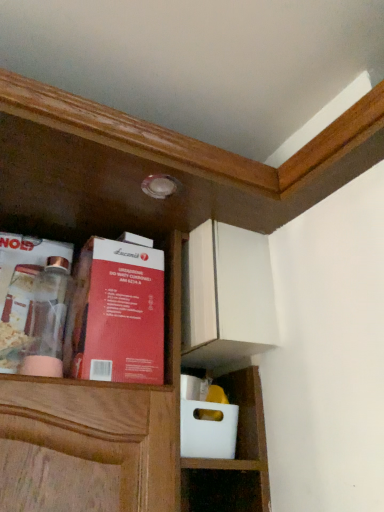
Question: Is clear glass jar at left, positioned as the 1th book in left-to-right order, inside or outside of red cardboard box at upper left, the first book viewed from the right?

Choices:
 (A) inside
 (B) outside

Answer: (B)

Question: In terms of width, does clear glass jar at left, positioned as the 1th book in left-to-right order, look wider or thinner when compared to red cardboard box at upper left, arranged as the 2th book when viewed from the left?

Choices:
 (A) wide
 (B) thin

Answer: (B)

Question: Considering the positions of clear glass jar at left, which ranks as the 2th book in right-to-left order, and red cardboard box at upper left, the first book viewed from the right, in the image, is clear glass jar at left, which ranks as the 2th book in right-to-left order, taller or shorter than red cardboard box at upper left, the first book viewed from the right,?

Choices:
 (A) tall
 (B) short

Answer: (B)

Question: Is point (87, 269) positioned closer to the camera than point (23, 343)?

Choices:
 (A) closer
 (B) farther

Answer: (B)

Question: Which is correct: red cardboard box at upper left, the first book viewed from the right, is inside clear glass jar at left, which ranks as the 2th book in right-to-left order, or outside of it?

Choices:
 (A) outside
 (B) inside

Answer: (A)

Question: Looking at the image, does red cardboard box at upper left, arranged as the 2th book when viewed from the left, seem bigger or smaller compared to clear glass jar at left, positioned as the 1th book in left-to-right order?

Choices:
 (A) big
 (B) small

Answer: (A)

Question: In the image, is red cardboard box at upper left, arranged as the 2th book when viewed from the left, positioned in front of or behind clear glass jar at left, positioned as the 1th book in left-to-right order?

Choices:
 (A) front
 (B) behind

Answer: (A)